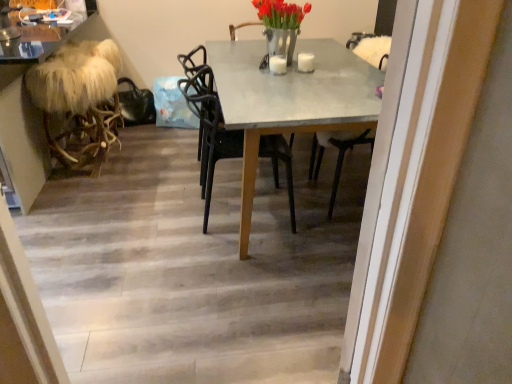
In order to click on vacant area located to the right-hand side of black plastic chair at center in this screenshot , I will do `click(318, 218)`.